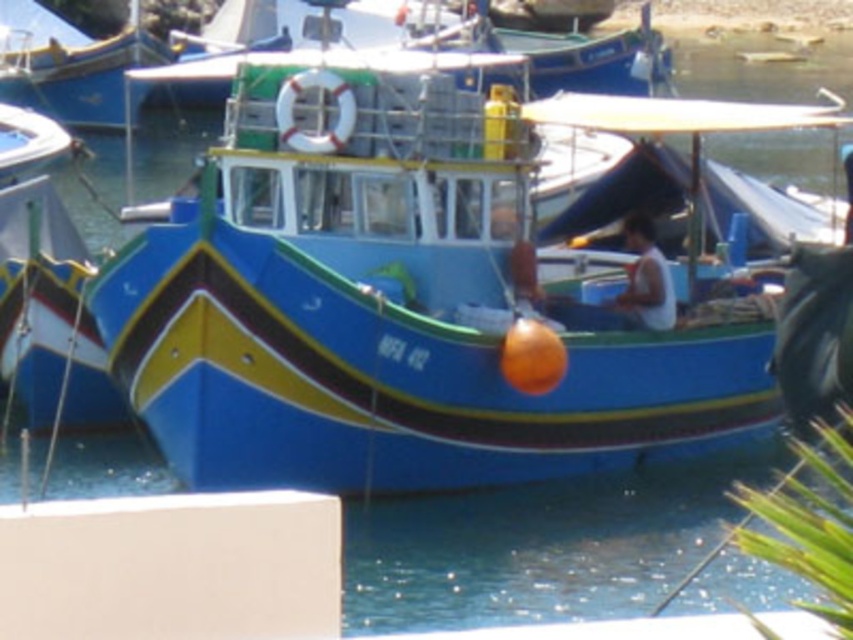
Question: Is blue glossy boat at center bigger than white fabric shirt at right?

Choices:
 (A) yes
 (B) no

Answer: (A)

Question: Is blue glossy boat at center further to the viewer compared to white fabric shirt at right?

Choices:
 (A) no
 (B) yes

Answer: (A)

Question: Is blue glossy boat at upper left closer to the viewer compared to white fabric shirt at right?

Choices:
 (A) no
 (B) yes

Answer: (A)

Question: Considering the real-world distances, which object is farthest from the blue glossy boat at upper left?

Choices:
 (A) white fabric shirt at right
 (B) blue glossy boat at center

Answer: (A)

Question: Which object is closer to the camera taking this photo?

Choices:
 (A) white fabric shirt at right
 (B) blue glossy boat at upper left

Answer: (A)

Question: Which object is the farthest from the white fabric shirt at right?

Choices:
 (A) blue glossy boat at upper left
 (B) blue glossy boat at center

Answer: (A)